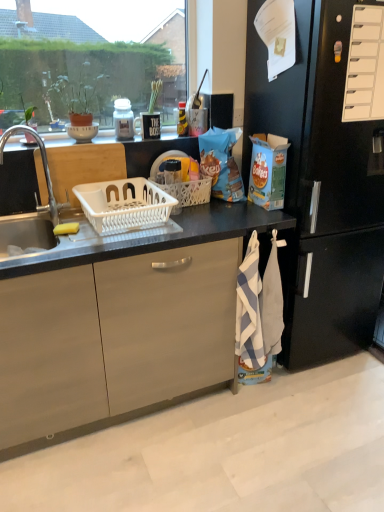
Question: Should I look upward or downward to see black matte refrigerator at right?

Choices:
 (A) down
 (B) up

Answer: (B)

Question: Considering the relative sizes of clear glass window at upper left and green leafy plant at upper left in the image provided, is clear glass window at upper left wider than green leafy plant at upper left?

Choices:
 (A) no
 (B) yes

Answer: (A)

Question: Is clear glass window at upper left thinner than green leafy plant at upper left?

Choices:
 (A) yes
 (B) no

Answer: (A)

Question: From the image's perspective, is clear glass window at upper left over green leafy plant at upper left?

Choices:
 (A) no
 (B) yes

Answer: (B)

Question: From the image's perspective, is clear glass window at upper left beneath green leafy plant at upper left?

Choices:
 (A) no
 (B) yes

Answer: (A)

Question: Can you see clear glass window at upper left touching green leafy plant at upper left?

Choices:
 (A) yes
 (B) no

Answer: (B)

Question: Can green leafy plant at upper left be found inside clear glass window at upper left?

Choices:
 (A) yes
 (B) no

Answer: (B)

Question: Is blue striped towel at lower right to the right of wooden cutting board at upper center from the viewer's perspective?

Choices:
 (A) yes
 (B) no

Answer: (A)

Question: Does blue striped towel at lower right have a larger size compared to wooden cutting board at upper center?

Choices:
 (A) no
 (B) yes

Answer: (B)

Question: Is blue striped towel at lower right far away from wooden cutting board at upper center?

Choices:
 (A) no
 (B) yes

Answer: (A)

Question: From the image's perspective, is blue striped towel at lower right under wooden cutting board at upper center?

Choices:
 (A) yes
 (B) no

Answer: (A)

Question: From a real-world perspective, is blue striped towel at lower right located higher than wooden cutting board at upper center?

Choices:
 (A) no
 (B) yes

Answer: (A)

Question: Is blue striped towel at lower right positioned in front of wooden cutting board at upper center?

Choices:
 (A) yes
 (B) no

Answer: (A)

Question: Is silver metallic sink at left smaller than blue striped towel at lower right?

Choices:
 (A) yes
 (B) no

Answer: (B)